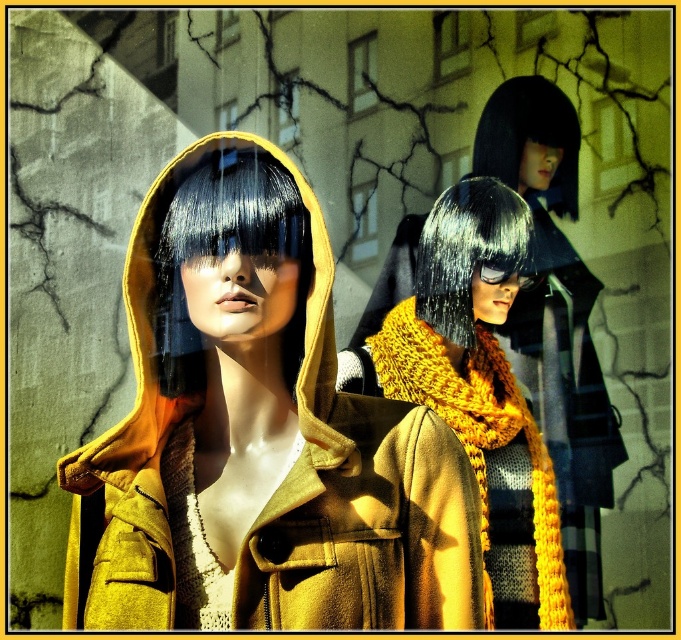
Based on the photo, is black matte wig at center positioned at the back of black silky hair at upper center?

No, black matte wig at center is in front of black silky hair at upper center.

Describe the element at coordinates (223, 252) in the screenshot. I see `black matte wig at center` at that location.

At what (x,y) coordinates should I click in order to perform the action: click on black matte wig at center. Please return your answer as a coordinate pair (x, y). Looking at the image, I should click on (223, 252).

Is knitted yellow scarf at center positioned behind black silky hair at upper center?

No, it is not.

What do you see at coordinates (477, 390) in the screenshot?
I see `knitted yellow scarf at center` at bounding box center [477, 390].

Identify the location of knitted yellow scarf at center. The image size is (681, 640). (477, 390).

Locate an element on the screen. knitted yellow scarf at center is located at coordinates [477, 390].

Where is `knitted yellow scarf at center`? Image resolution: width=681 pixels, height=640 pixels. knitted yellow scarf at center is located at coordinates (477, 390).